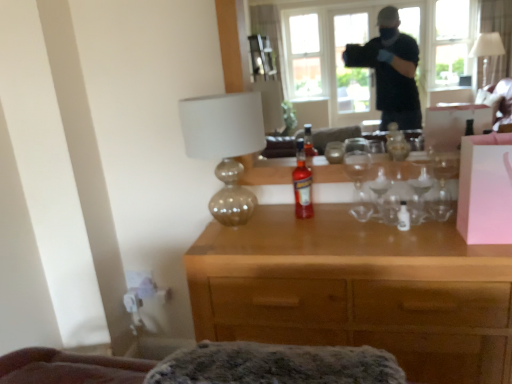
This screenshot has height=384, width=512. What do you see at coordinates (485, 189) in the screenshot?
I see `pink matte box at right` at bounding box center [485, 189].

Describe the element at coordinates (302, 184) in the screenshot. The width and height of the screenshot is (512, 384). I see `translucent glass bottle at center` at that location.

This screenshot has height=384, width=512. I want to click on wooden desk at center, so click(358, 290).

Is pink matte box at right aimed at transparent glass window at upper center?

No, pink matte box at right does not turn towards transparent glass window at upper center.

Is pink matte box at right to the left or to the right of transparent glass window at upper center in the image?

pink matte box at right is positioned on transparent glass window at upper center's right side.

Looking at this image, does pink matte box at right have a greater width compared to transparent glass window at upper center?

Correct, the width of pink matte box at right exceeds that of transparent glass window at upper center.

Measure the distance from transparent glass window at upper center to wooden desk at center.

The distance of transparent glass window at upper center from wooden desk at center is 1.08 meters.

From a real-world perspective, which object stands above the other?

In real-world perspective, transparent glass window at upper center is above.

Which point is more distant from viewer, (342, 67) or (393, 259)?

The point (342, 67) is behind.

From the image's perspective, which one is positioned higher, transparent glass window at upper center or wooden desk at center?

transparent glass window at upper center appears higher in the image.

Which object is thinner, wooden desk at center or pink matte box at right?

pink matte box at right.

Considering the sizes of objects wooden desk at center and pink matte box at right in the image provided, who is shorter, wooden desk at center or pink matte box at right?

Standing shorter between the two is pink matte box at right.

Is point (221, 297) closer or farther from the camera than point (480, 157)?

Point (221, 297).

Is wooden desk at center further to the viewer compared to pink matte box at right?

No, the depth of wooden desk at center is less than that of pink matte box at right.

Is wooden desk at center at the back of matte gold lamp at center?

No, wooden desk at center is not at the back of matte gold lamp at center.

Does matte gold lamp at center come behind wooden desk at center?

Yes.

Which is correct: matte gold lamp at center is inside wooden desk at center, or outside of it?

The correct answer is: outside.

Consider the image. From a real-world perspective, between matte gold lamp at center and wooden desk at center, who is vertically higher?

matte gold lamp at center is physically above.

Which is more to the right, pink matte box at right or wooden desk at center?

pink matte box at right is more to the right.

Is pink matte box at right shorter than wooden desk at center?

Indeed, pink matte box at right has a lesser height compared to wooden desk at center.

Which is behind, point (489, 141) or point (365, 227)?

The point (365, 227) is farther.

Does pink matte box at right lie behind wooden desk at center?

Yes, it is.

How many degrees apart are the facing directions of matte gold lamp at center and pink matte box at right?

They differ by 3.72 degrees in their facing directions.

Looking at this image, is matte gold lamp at center next to pink matte box at right and touching it?

No, matte gold lamp at center is not beside pink matte box at right.

In the image, is matte gold lamp at center on the left side or the right side of pink matte box at right?

matte gold lamp at center is positioned on pink matte box at right's left side.

Where is `lamp that is above the pink matte box at right (from the image's perspective)`? lamp that is above the pink matte box at right (from the image's perspective) is located at coordinates (225, 146).

What's the angular difference between wooden desk at center and translucent glass bottle at center's facing directions?

3.55 degrees.

Looking at this image, how distant is wooden desk at center from translucent glass bottle at center?

wooden desk at center and translucent glass bottle at center are 42.14 centimeters apart.

Which object is more forward, wooden desk at center or translucent glass bottle at center?

wooden desk at center is more forward.

Do you think wooden desk at center is within translucent glass bottle at center, or outside of it?

wooden desk at center cannot be found inside translucent glass bottle at center.

This screenshot has width=512, height=384. Identify the location of box in front of the transparent glass window at upper center. (485, 189).

At what (x,y) coordinates should I click in order to perform the action: click on desk beneath the transparent glass window at upper center (from a real-world perspective). Please return your answer as a coordinate pair (x, y). The width and height of the screenshot is (512, 384). Looking at the image, I should click on (358, 290).

Which object lies nearer to the anchor point pink matte box at right, wooden desk at center or transparent glass window at upper center?

Based on the image, wooden desk at center appears to be nearer to pink matte box at right.

Considering their positions, is pink matte box at right positioned closer to wooden desk at center than transparent glass window at upper center?

Based on the image, pink matte box at right appears to be nearer to wooden desk at center.

When comparing their distances from transparent glass window at upper center, does wooden desk at center or translucent glass bottle at center seem closer?

Based on the image, translucent glass bottle at center appears to be nearer to transparent glass window at upper center.

Considering their positions, is matte gold lamp at center positioned closer to wooden desk at center than pink matte box at right?

pink matte box at right is closer to wooden desk at center.

Estimate the real-world distances between objects in this image. Which object is further from transparent glass window at upper center, matte gold lamp at center or translucent glass bottle at center?

The object further to transparent glass window at upper center is matte gold lamp at center.

Considering their positions, is wooden desk at center positioned closer to pink matte box at right than translucent glass bottle at center?

Based on the image, wooden desk at center appears to be nearer to pink matte box at right.

Which object lies nearer to the anchor point transparent glass window at upper center, wooden desk at center or matte gold lamp at center?

The object closer to transparent glass window at upper center is matte gold lamp at center.

When comparing their distances from transparent glass window at upper center, does translucent glass bottle at center or wooden desk at center seem further?

Based on the image, wooden desk at center appears to be further to transparent glass window at upper center.

Image resolution: width=512 pixels, height=384 pixels. In order to click on box between transparent glass window at upper center and wooden desk at center in the up-down direction in this screenshot , I will do `click(485, 189)`.

The image size is (512, 384). I want to click on bottle located between matte gold lamp at center and pink matte box at right in the left-right direction, so click(302, 184).

Locate an element on the screen. Image resolution: width=512 pixels, height=384 pixels. bottle between matte gold lamp at center and wooden desk at center in the up-down direction is located at coordinates (302, 184).

Identify the location of window located between matte gold lamp at center and pink matte box at right in the left-right direction. This screenshot has width=512, height=384. (329, 60).